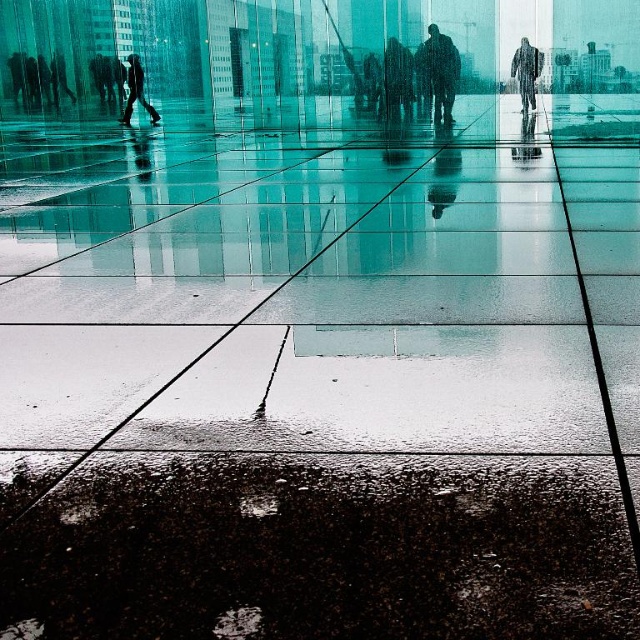
Question: Can you confirm if silhouette raincoat at center is thinner than raincoat textured coat at upper right?

Choices:
 (A) yes
 (B) no

Answer: (B)

Question: Among these points, which one is farthest from the camera?

Choices:
 (A) (125, 120)
 (B) (532, 51)
 (C) (410, 74)

Answer: (A)

Question: Which is nearer to the silhouette raincoat at center?

Choices:
 (A) dark gray fabric person at upper left
 (B) matte black jacket at center

Answer: (B)

Question: Does silhouette raincoat at center appear on the right side of matte black jacket at center?

Choices:
 (A) no
 (B) yes

Answer: (B)

Question: Which point is closer to the camera?

Choices:
 (A) (131, 100)
 (B) (529, 93)
 (C) (394, 108)

Answer: (B)

Question: Can you confirm if raincoat textured coat at upper right is positioned above dark gray fabric person at upper left?

Choices:
 (A) yes
 (B) no

Answer: (B)